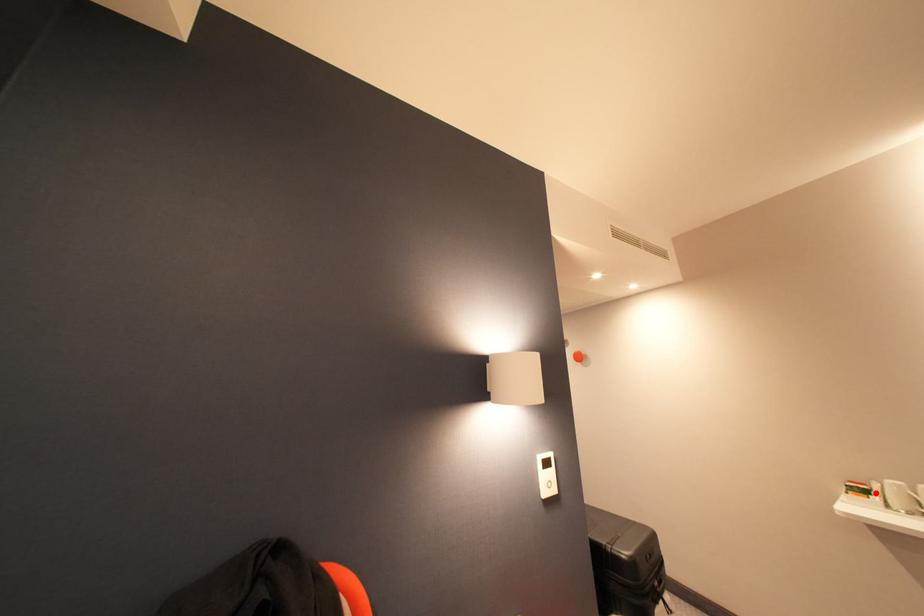
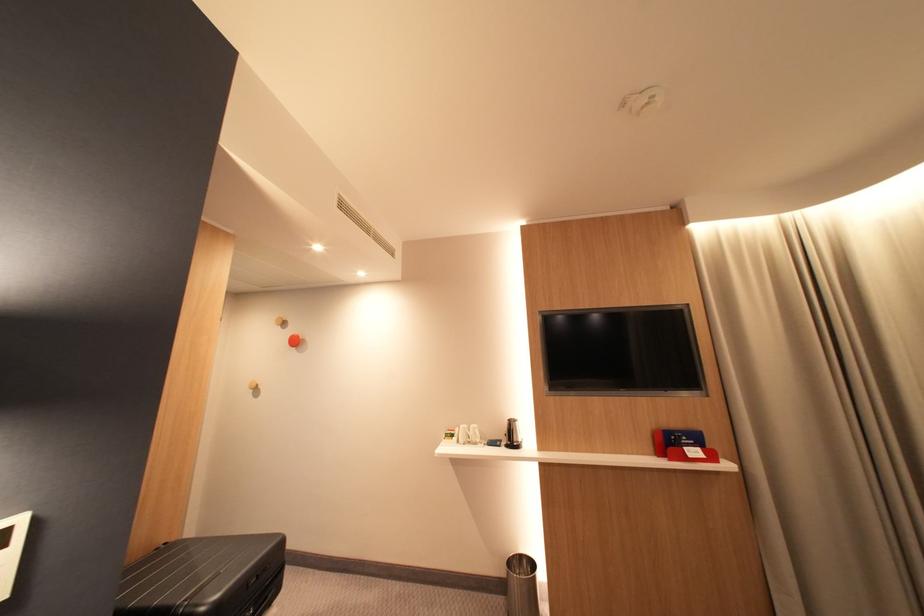
Question: I am providing you with two images of the same scene from different viewpoints. In image1, a red point is highlighted. Considering the same 3D point in image2, which of the following is correct?

Choices:
 (A) It is closer
 (B) It is farther

Answer: (B)